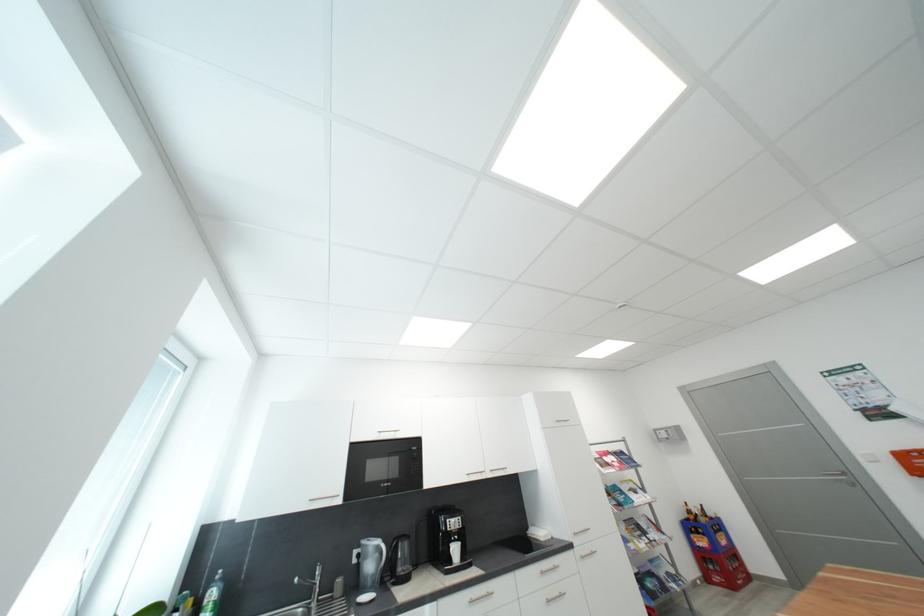
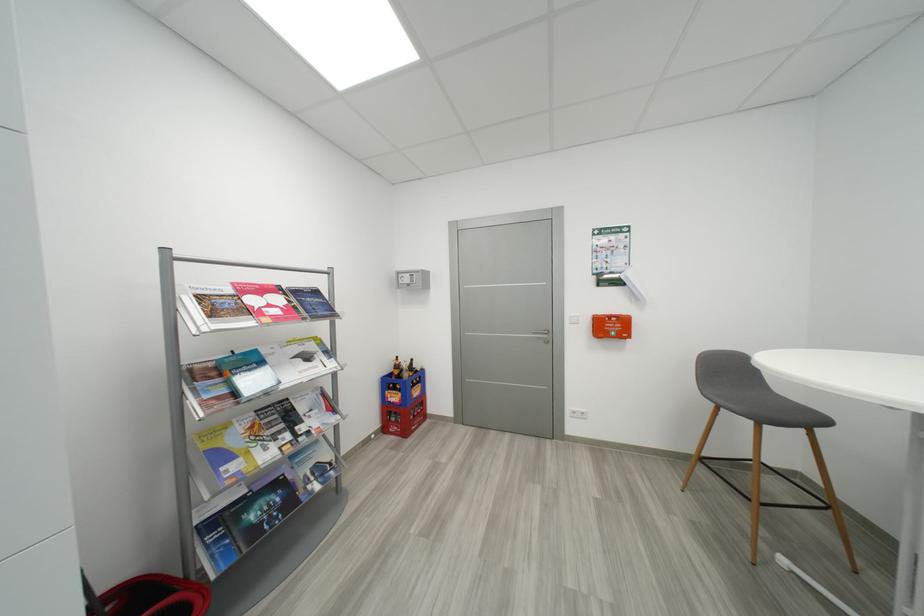
The point at [659,576] is marked in the first image. Where is the corresponding point in the second image?

(285, 485)